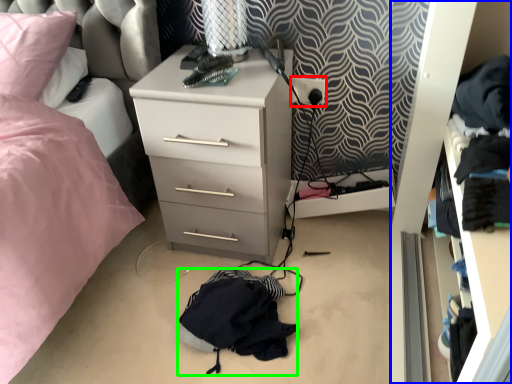
Question: Which object is the closest to the electric outlet (highlighted by a red box)? Choose among these: dresser (highlighted by a blue box) or clothing (highlighted by a green box).

Choices:
 (A) dresser
 (B) clothing

Answer: (A)